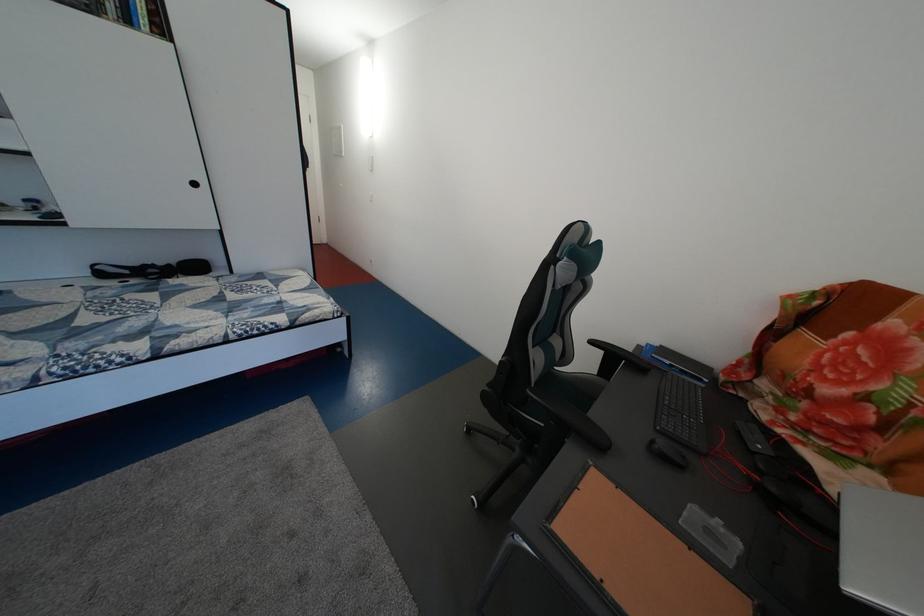
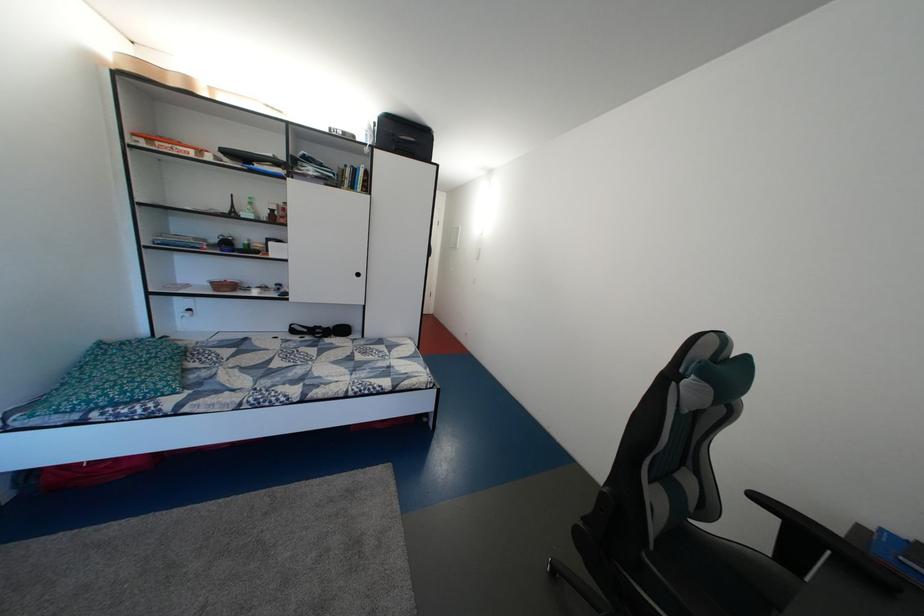
Find the pixel in the second image that matches point 543,392 in the first image.

(662, 554)